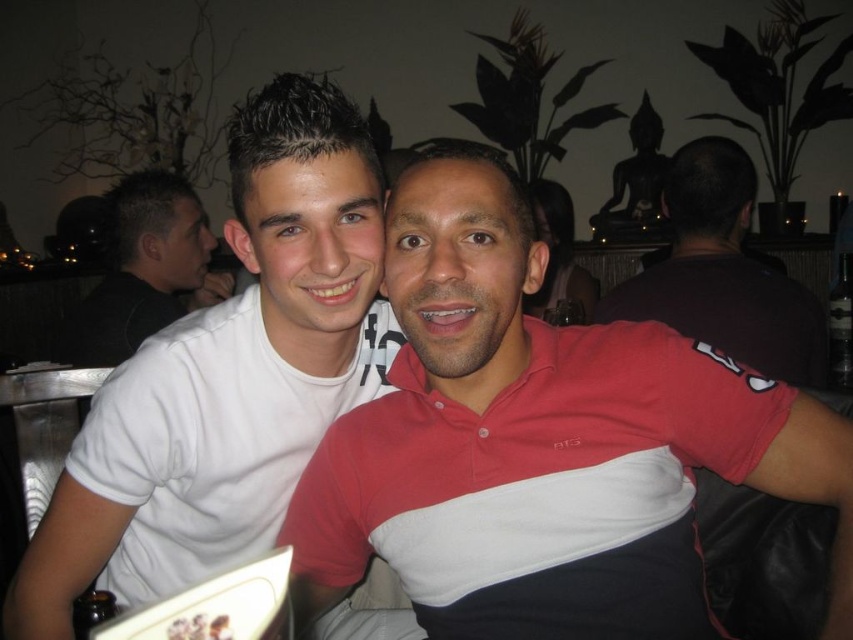
You are standing in a cafe and want to place a small plant pot exactly at the point marked as point (561, 349). The table in front of you is 36 inches away from you. Can you place the plant pot on the table without moving closer?

The distance of point (561, 349) from the viewer is 35.75 inches, which is slightly less than the 36 inches distance to the table. Therefore, you can place the plant pot on the table without needing to move closer.

You are a photographer standing 5 feet away from the dark brown shirt at upper right and white matte shirt at left. You want to take a photo of both shirts in the same frame without moving the subjects. Can you do it with a standard camera lens that has a maximum focal length of 50mm?

The distance between the dark brown shirt at upper right and white matte shirt at left is 4.07 feet. Since you are 5 feet away from them, the total distance from you to the farthest shirt is about 5 feet plus half of 4.07 feet, which is approximately 7 feet. A standard 50mm lens can capture subjects within this range, so yes, you can take the photo without moving the subjects.